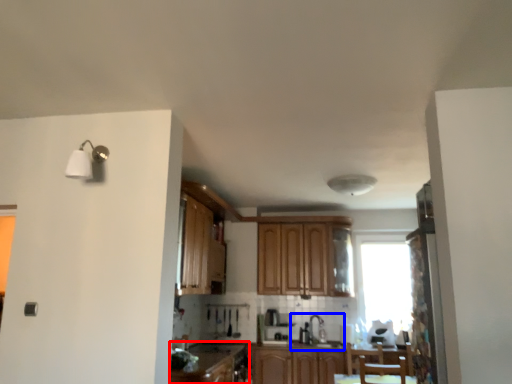
Question: Which point is closer to the camera, cabinetry (highlighted by a red box) or sink (highlighted by a blue box)?

Choices:
 (A) cabinetry
 (B) sink

Answer: (A)